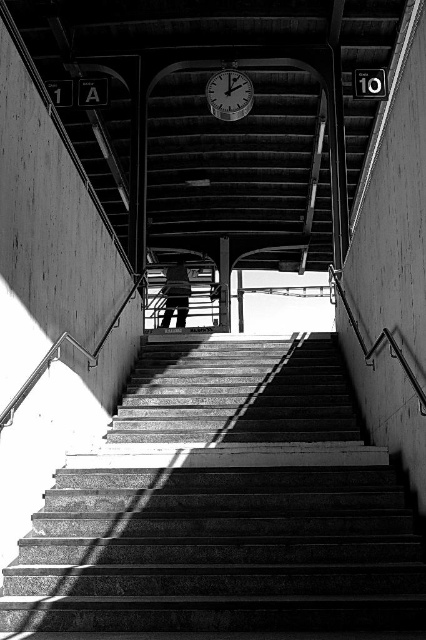
You are a delivery person carrying a package that requires a flat surface to place temporarily. You see a metallic silver skateboard at center and a smooth concrete pillar at center. Which object can you use to place your package?

The metallic silver skateboard at center has a lesser height compared to the smooth concrete pillar at center, so the smooth concrete pillar at center is taller and more stable, making it suitable for placing the package.

You are standing at the bottom of the staircase and want to place a small potted plant between the metallic silver skateboard at center and the smooth concrete pillar at center. Is there enough space between them to fit the plant?

The smooth concrete pillar at center is behind the metallic silver skateboard at center, so there is no space between them to place a small potted plant.